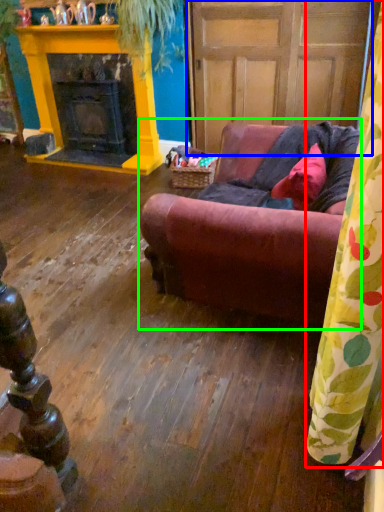
Question: Which object is positioned farthest from curtain (highlighted by a red box)? Select from door (highlighted by a blue box) and studio couch (highlighted by a green box).

Choices:
 (A) door
 (B) studio couch

Answer: (A)